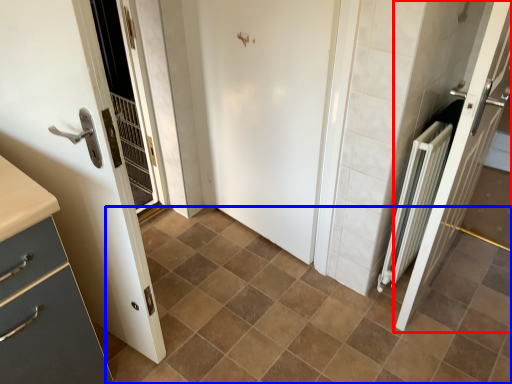
Question: Which of the following is the closest to the observer, door (highlighted by a red box) or ceramic tile (highlighted by a blue box)?

Choices:
 (A) door
 (B) ceramic tile

Answer: (A)